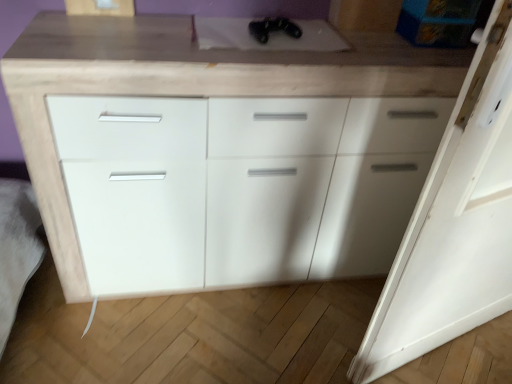
At what (x,y) coordinates should I click in order to perform the action: click on vacant area that lies to the right of black matte controller at upper center. Please return your answer as a coordinate pair (x, y). Image resolution: width=512 pixels, height=384 pixels. Looking at the image, I should click on (380, 48).